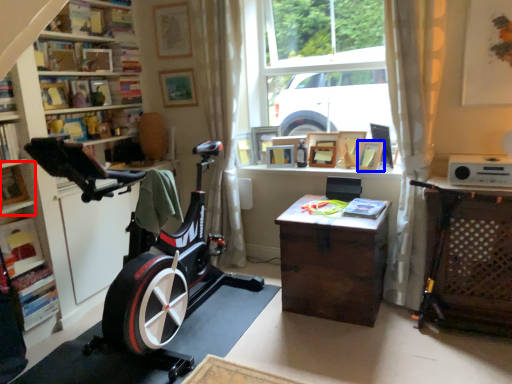
Question: Among these objects, which one is farthest to the camera, shelf (highlighted by a red box) or picture frame (highlighted by a blue box)?

Choices:
 (A) shelf
 (B) picture frame

Answer: (B)